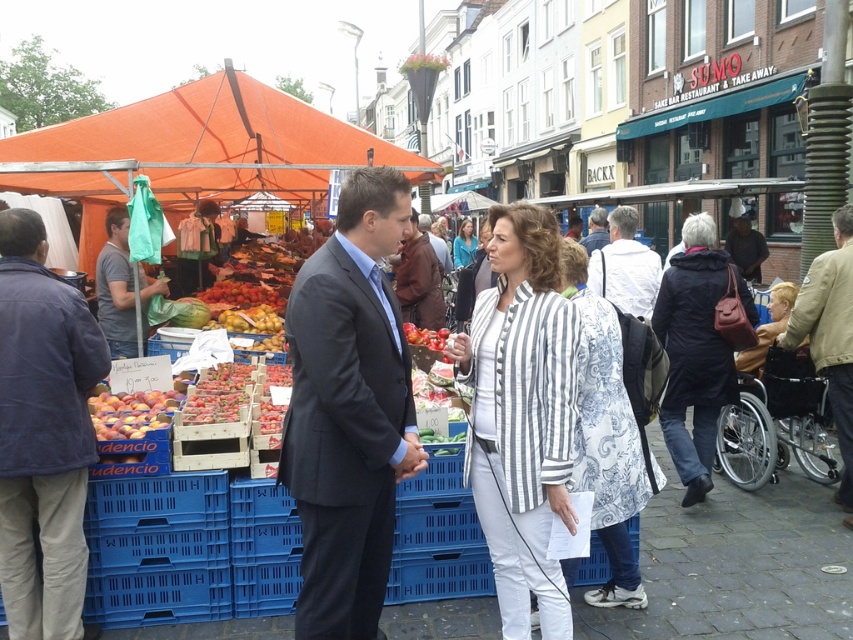
In the scene shown: You are standing at the center of the market and want to find the brown leather jacket at lower right. According to the coordinates provided, in which direction should you move to locate it?

The brown leather jacket at lower right is located at coordinates point (830,337). Since you are at the center, you should move downward and to the right to reach it.

You are a photographer standing at the edge of the market scene. You want to take a photo that includes both the brown leather jacket at lower right and the light brown hair at center. Which object should you adjust your camera focus to first to ensure both are in the frame?

The brown leather jacket at lower right is closer to the viewer than the light brown hair at center. To ensure both are in focus, adjust your camera focus starting with the brown leather jacket at lower right first, then the light brown hair at center.

You are a photographer trying to capture a clear shot of the light brown hair at center without the brown leather jacket at lower right blocking it. Where should you position yourself relative to the subjects?

The photographer should position themselves to the left of the subjects, as the brown leather jacket at lower right is wider than the light brown hair at center, so moving left would place the jacket out of the frame or behind the main subject.